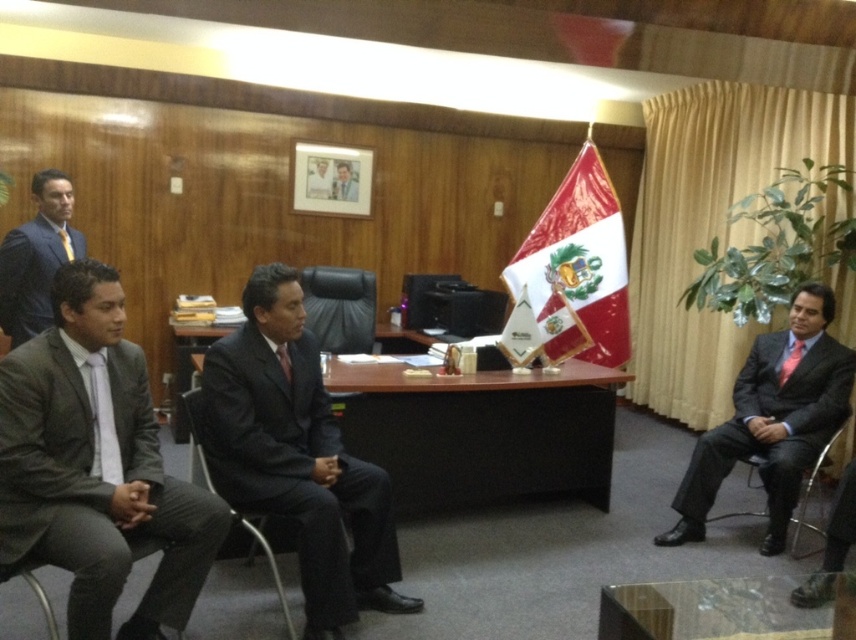
Question: Which is farther from the black leather chair at center?

Choices:
 (A) metallic silver chair at right
 (B) metallic gray chair at lower left

Answer: (A)

Question: Among these objects, which one is farthest from the camera?

Choices:
 (A) metallic gray chair at lower left
 (B) matte gray suit at left

Answer: (A)

Question: Can you confirm if blue suit at left is positioned above black fabric chair at center?

Choices:
 (A) yes
 (B) no

Answer: (A)

Question: Is transparent glass table at lower center to the left of metallic silver chair at right from the viewer's perspective?

Choices:
 (A) no
 (B) yes

Answer: (B)

Question: Which object is farther from the camera taking this photo?

Choices:
 (A) smooth skin man at center
 (B) blue suit at left
 (C) black leather chair at center
 (D) matte black suit at right

Answer: (A)

Question: Does black leather chair at center have a larger size compared to smooth skin man at center?

Choices:
 (A) no
 (B) yes

Answer: (B)